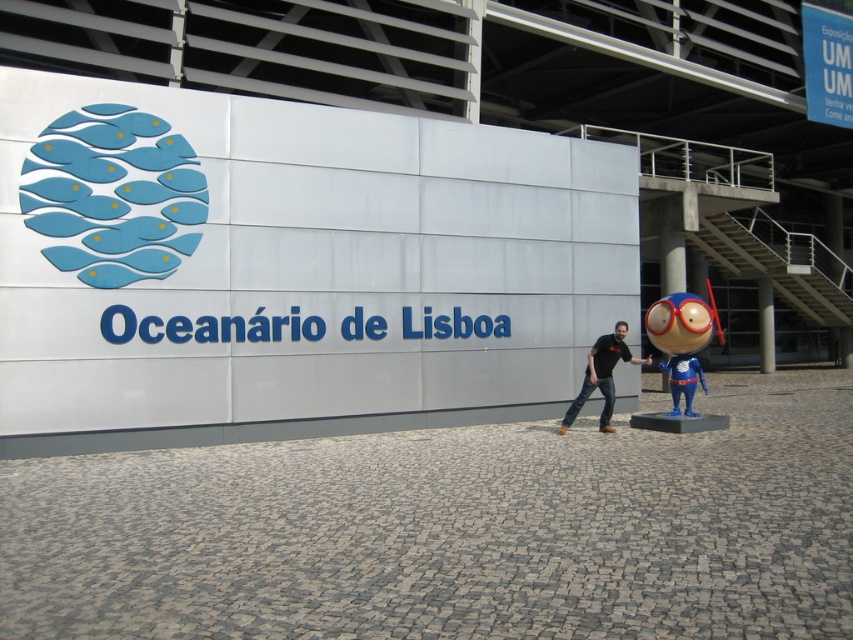
You are holding a measuring tape and need to determine if the blue glossy toy at right can fit into a box that is the same width as the black matte shirt at center. Can it fit?

The blue glossy toy at right might be wider than the black matte shirt at center, so it may not fit into the box designed for the black matte shirt at center.

You are a photographer at the Oceanario de Lisboa. You need to capture a photo where both the blue glossy toy at right and the black matte shirt at center are visible. Based on their positions, which object should you ensure is in the foreground to include both in the frame?

The blue glossy toy at right is above the black matte shirt at center. To include both in the frame, ensure the black matte shirt at center is in the foreground since it is lower and the toy is positioned above it.

You are standing at the entrance of the Oceanario de Lisboa and see the large white wall with the name written in blue letters. There is a point marked at coordinate (x=682, y=340). What object is located at that point?

The point at coordinate (x=682, y=340) marks the blue glossy toy at right.